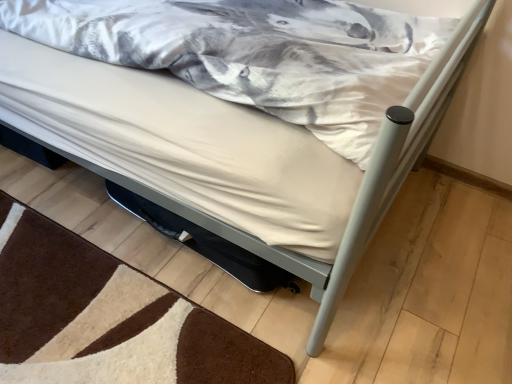
At what (x,y) coordinates should I click in order to perform the action: click on brown shaggy rug at lower left. Please return your answer as a coordinate pair (x, y). The image size is (512, 384). Looking at the image, I should click on (108, 318).

What do you see at coordinates (108, 318) in the screenshot?
I see `brown shaggy rug at lower left` at bounding box center [108, 318].

Locate an element on the screen. The image size is (512, 384). brown shaggy rug at lower left is located at coordinates (108, 318).